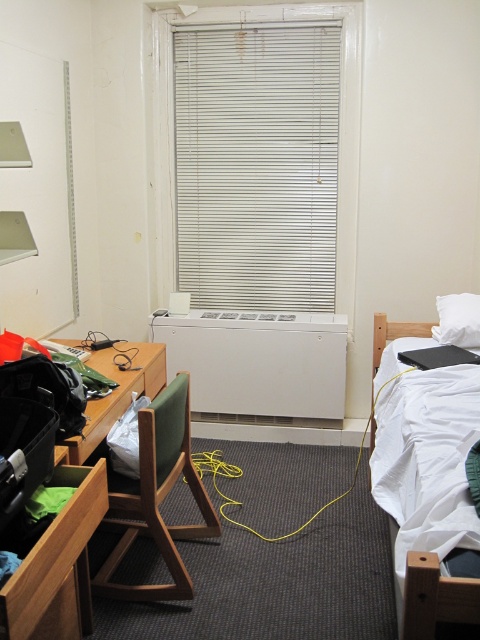
Question: Is white matte blinds at center behind white matte radiator at center?

Choices:
 (A) yes
 (B) no

Answer: (B)

Question: Does white matte blinds at center appear under wooden desk at left?

Choices:
 (A) no
 (B) yes

Answer: (A)

Question: Which of the following is the farthest from the observer?

Choices:
 (A) (135, 518)
 (B) (467, 320)

Answer: (A)

Question: Is wooden desk at left bigger than wooden drawer at center?

Choices:
 (A) no
 (B) yes

Answer: (B)

Question: Based on their relative distances, which object is farther from the white soft bed at right?

Choices:
 (A) wooden drawer at center
 (B) white soft pillow at upper right
 (C) white matte radiator at center
 (D) wooden desk at left

Answer: (D)

Question: Which point is closer to the camera?

Choices:
 (A) (136, 509)
 (B) (276, 316)
 (C) (422, 611)
 (D) (271, 72)

Answer: (C)